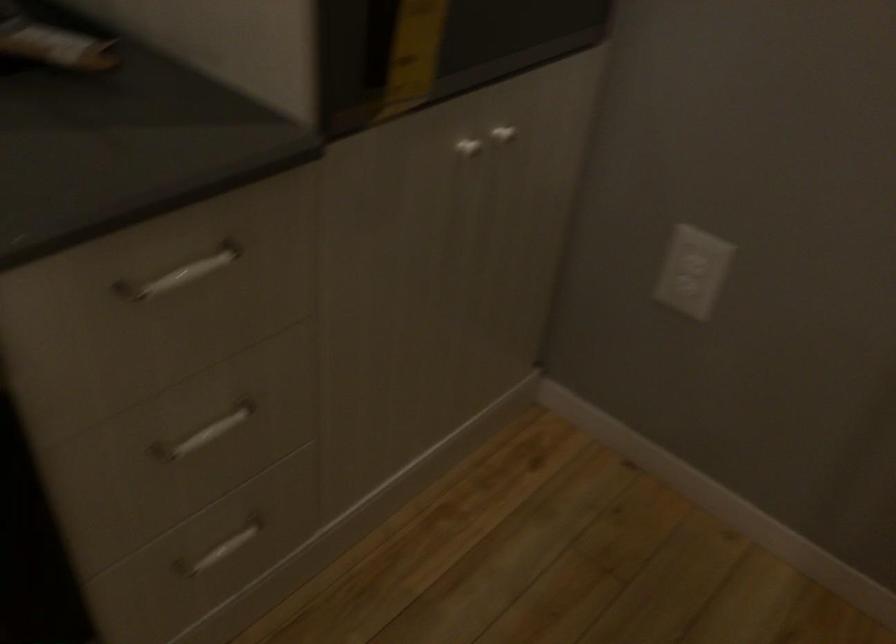
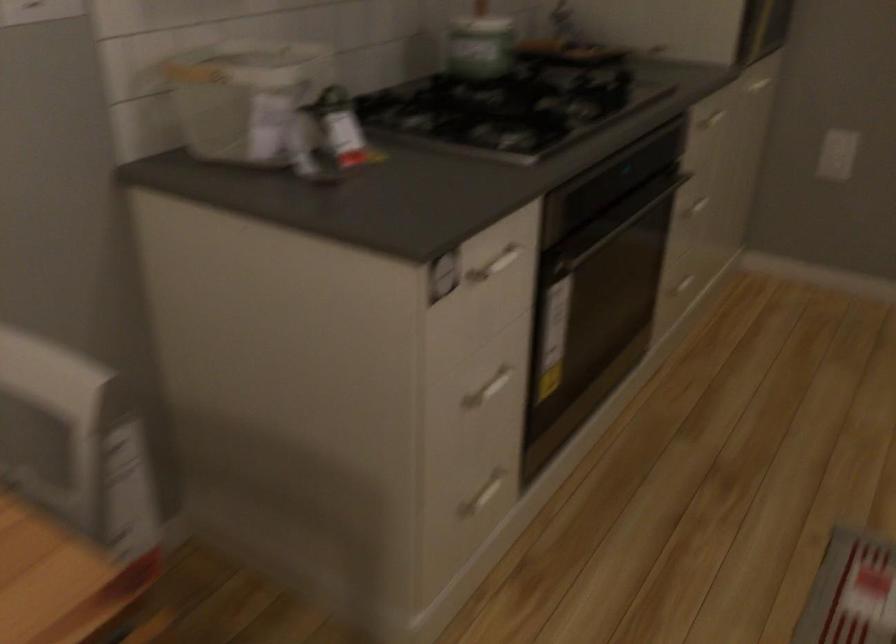
Locate, in the second image, the point that corresponds to (x=202, y=424) in the first image.

(694, 204)